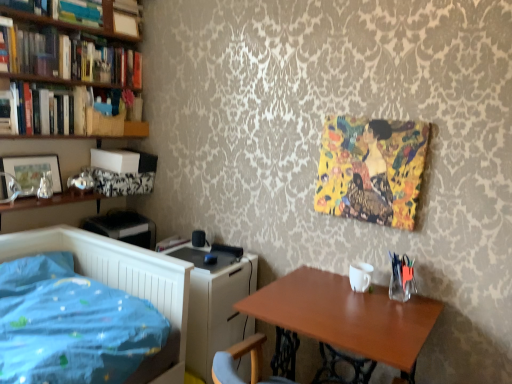
Question: From a real-world perspective, is hardcover books at upper left, which is counted as the third book, starting from the top, above or below hardcover books at upper left, acting as the third book starting from the bottom?

Choices:
 (A) below
 (B) above

Answer: (B)

Question: Considering the relative positions of hardcover books at upper left, which is counted as the third book, starting from the top, and hardcover books at upper left, the 4th book positioned from the top, in the image provided, is hardcover books at upper left, which is counted as the third book, starting from the top, to the left or to the right of hardcover books at upper left, the 4th book positioned from the top,?

Choices:
 (A) left
 (B) right

Answer: (B)

Question: Which is farther from the white glossy computer desk at center?

Choices:
 (A) matte white book at upper left, which is the 6th book from bottom to top
 (B) hardcover book at center, acting as the 1th book starting from the bottom
 (C) hardcover books at upper left, which is counted as the fourth book, starting from the bottom
 (D) yellow fabric painting at upper right
 (E) hardcover books at upper left, the 4th book positioned from the top

Answer: (A)

Question: Which is nearer to the wooden table at lower right?

Choices:
 (A) hardcover book at center, arranged as the sixth book when viewed from the top
 (B) white glossy computer desk at center
 (C) hardcover books at upper left, the 4th book positioned from the top
 (D) hardcover books at upper left, which is counted as the fourth book, starting from the bottom
 (E) yellow fabric painting at upper right

Answer: (B)